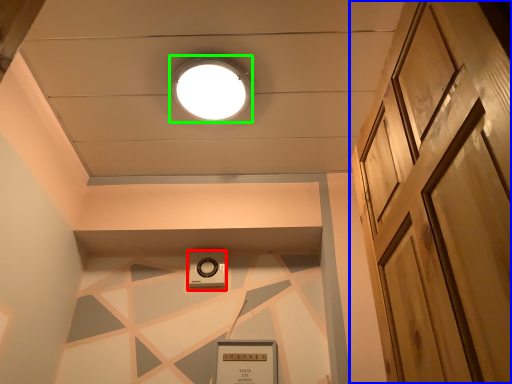
Question: Estimate the real-world distances between objects in this image. Which object is farther from thermostat (highlighted by a red box), door (highlighted by a blue box) or droplight (highlighted by a green box)?

Choices:
 (A) door
 (B) droplight

Answer: (A)